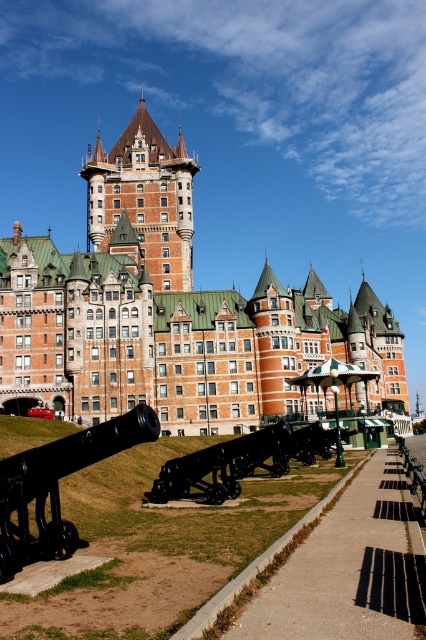
Does concrete sidewalk at center have a smaller size compared to wooden park bench at lower right?

Indeed, concrete sidewalk at center has a smaller size compared to wooden park bench at lower right.

Does concrete sidewalk at center appear over wooden park bench at lower right?

Yes, concrete sidewalk at center is above wooden park bench at lower right.

Who is more distant from viewer, (414, 609) or (422, 474)?

Positioned behind is point (422, 474).

Identify the location of concrete sidewalk at center. This screenshot has width=426, height=640. (350, 568).

Between orange brick castle at center and black polished cannon at center, which one appears on the left side from the viewer's perspective?

orange brick castle at center is more to the left.

Which is behind, point (362, 332) or point (238, 465)?

Point (362, 332)

I want to click on orange brick castle at center, so tap(172, 314).

Who is positioned more to the left, black matte cannon at lower left or black polished cannon at center?

black matte cannon at lower left is more to the left.

Consider the image. Is black matte cannon at lower left wider than black polished cannon at center?

In fact, black matte cannon at lower left might be narrower than black polished cannon at center.

Image resolution: width=426 pixels, height=640 pixels. What do you see at coordinates (57, 484) in the screenshot? I see `black matte cannon at lower left` at bounding box center [57, 484].

Locate an element on the screen. Image resolution: width=426 pixels, height=640 pixels. black matte cannon at lower left is located at coordinates (57, 484).